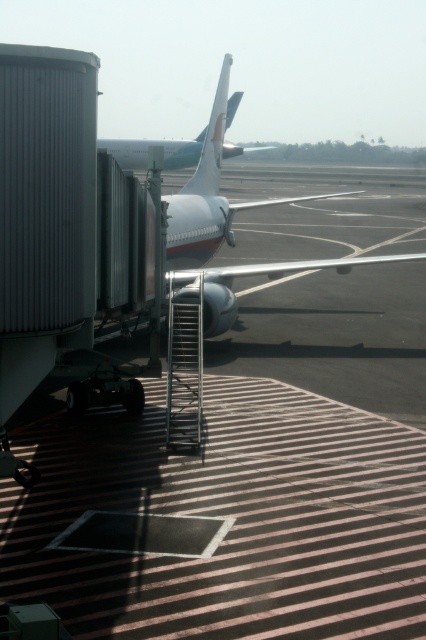
Can you confirm if smooth asphalt tarmac at center is taller than white glossy airplane at center?

No, smooth asphalt tarmac at center is not taller than white glossy airplane at center.

Is smooth asphalt tarmac at center wider than white glossy airplane at center?

Yes.

Image resolution: width=426 pixels, height=640 pixels. What do you see at coordinates (249, 476) in the screenshot? I see `smooth asphalt tarmac at center` at bounding box center [249, 476].

Where is `smooth asphalt tarmac at center`? The width and height of the screenshot is (426, 640). smooth asphalt tarmac at center is located at coordinates (249, 476).

Is white glossy airplane at center bigger than white glossy tail at upper center?

Yes, white glossy airplane at center is bigger than white glossy tail at upper center.

Is point (167, 221) closer to viewer compared to point (204, 186)?

Yes, point (167, 221) is in front of point (204, 186).

Find the location of `white glossy airplane at center`. white glossy airplane at center is located at coordinates (209, 196).

Who is shorter, smooth asphalt tarmac at center or white glossy tail at upper center?

white glossy tail at upper center is shorter.

Is smooth asphalt tarmac at center below white glossy tail at upper center?

Yes, smooth asphalt tarmac at center is below white glossy tail at upper center.

Between point (89, 436) and point (192, 182), which one is positioned in front?

Positioned in front is point (89, 436).

The image size is (426, 640). Identify the location of smooth asphalt tarmac at center. (249, 476).